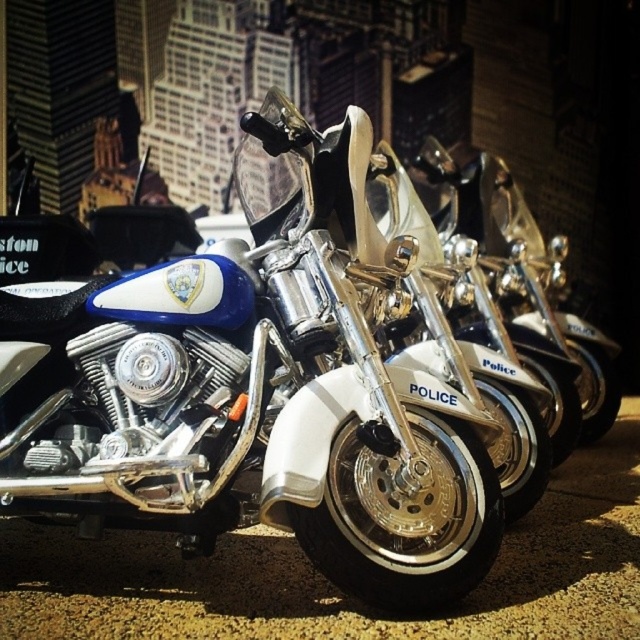
Can you confirm if white glossy police motorcycle at center is taller than black asphalt pavement at center?

Indeed, white glossy police motorcycle at center has a greater height compared to black asphalt pavement at center.

Is white glossy police motorcycle at center smaller than black asphalt pavement at center?

Correct, white glossy police motorcycle at center occupies less space than black asphalt pavement at center.

Locate an element on the screen. Image resolution: width=640 pixels, height=640 pixels. white glossy police motorcycle at center is located at coordinates (257, 388).